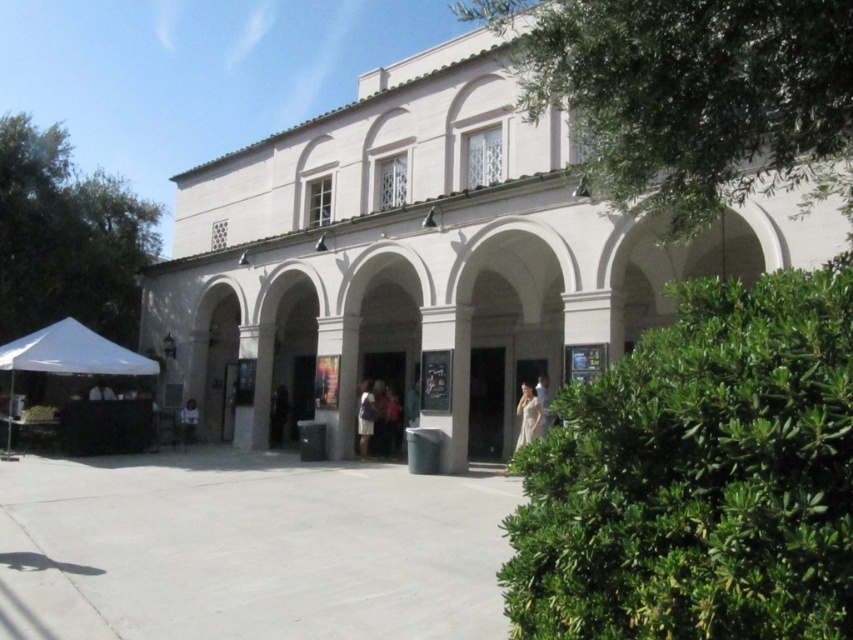
Between green leafy bush at center and white fabric dress at center, which one has less height?

white fabric dress at center

Is green leafy bush at center thinner than white fabric dress at center?

No, green leafy bush at center is not thinner than white fabric dress at center.

Between point (833, 584) and point (374, 400), which one is positioned in front?

Point (833, 584) is in front.

The width and height of the screenshot is (853, 640). Find the location of `green leafy bush at center`. green leafy bush at center is located at coordinates (699, 476).

From the picture: Between white smooth arcade at center and green leafy bush at center, which one appears on the right side from the viewer's perspective?

From the viewer's perspective, green leafy bush at center appears more on the right side.

Is white smooth arcade at center positioned in front of green leafy bush at center?

No, white smooth arcade at center is behind green leafy bush at center.

Is point (248, 204) closer to viewer compared to point (840, 541)?

No, (248, 204) is further to viewer.

Image resolution: width=853 pixels, height=640 pixels. What are the coordinates of `white smooth arcade at center` in the screenshot? It's located at (466, 232).

Is white fabric dress at center shorter than white fabric bag at center?

No, white fabric dress at center is not shorter than white fabric bag at center.

Does white fabric dress at center have a lesser width compared to white fabric bag at center?

Yes.

Which is behind, point (370, 397) or point (190, 404)?

The point (190, 404) is more distant.

Identify the location of white fabric dress at center. (364, 417).